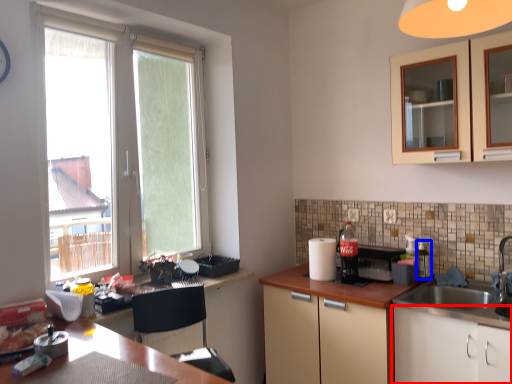
Question: Which object is further to the camera taking this photo, cabinetry (highlighted by a red box) or bottle (highlighted by a blue box)?

Choices:
 (A) cabinetry
 (B) bottle

Answer: (B)